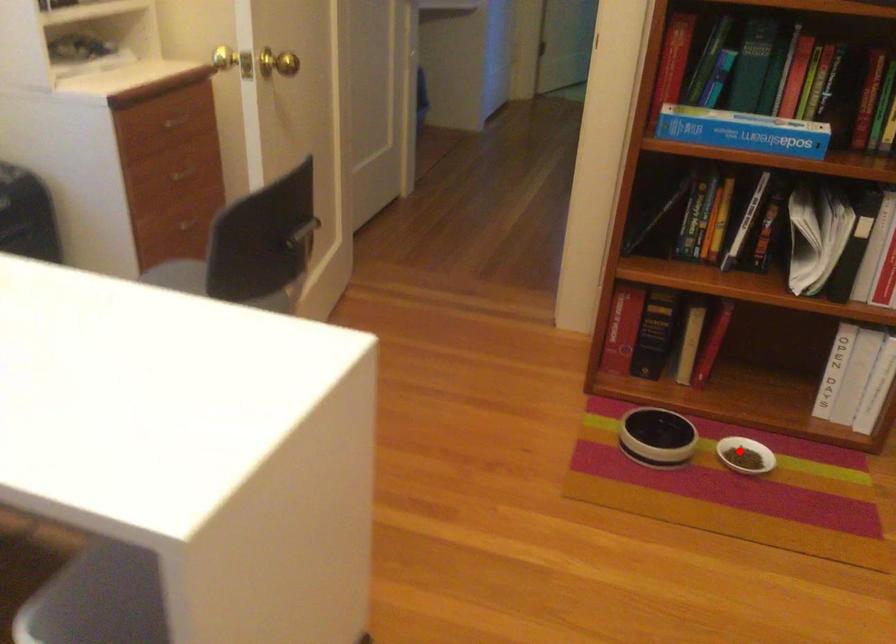
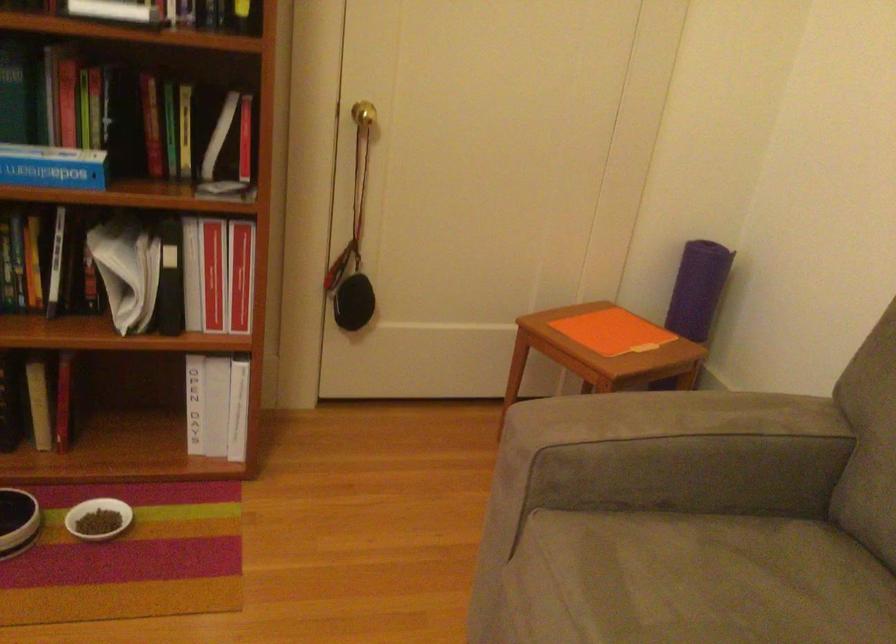
Find the pixel in the second image that matches the highlighted location in the first image.

(98, 518)